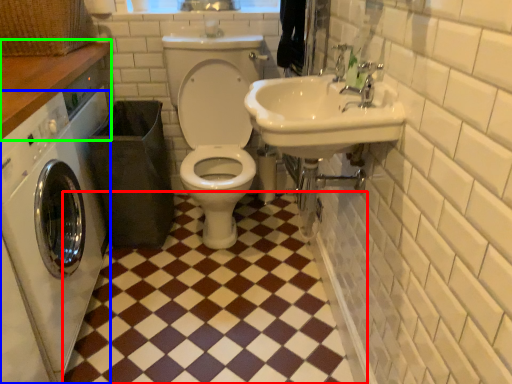
Question: Based on their relative distances, which object is farther from ceramic tile (highlighted by a red box)? Choose from washing machine (highlighted by a blue box) and counter top (highlighted by a green box).

Choices:
 (A) washing machine
 (B) counter top

Answer: (B)